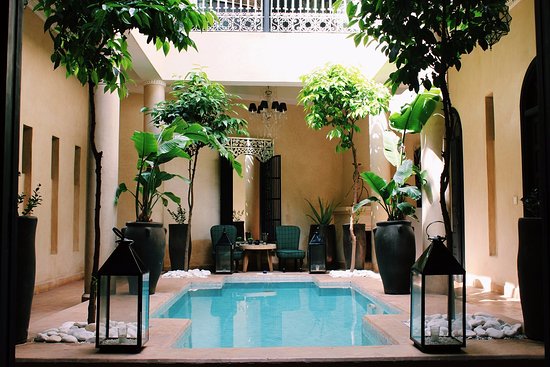
I want to click on right lantern, so click(437, 263).